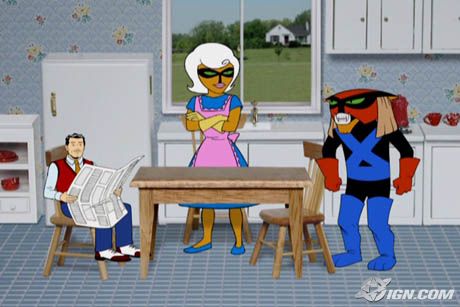
I want to click on tables, so click(x=239, y=180).